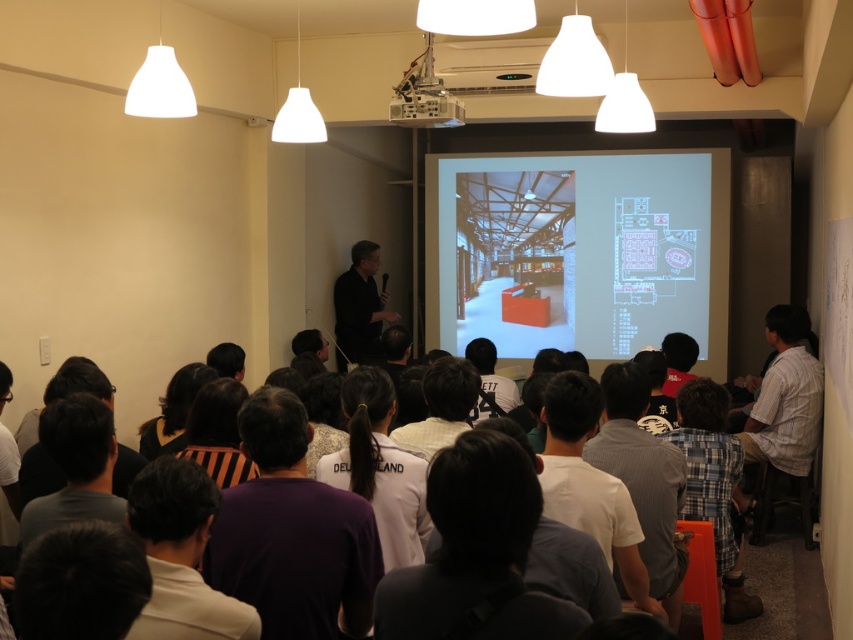
Does dark gray shirt at center have a larger size compared to black hair at center?

Yes.

Is point (352, 349) farther from viewer compared to point (155, 444)?

Yes, it is behind point (155, 444).

I want to click on dark gray shirt at center, so click(358, 308).

Between point (340, 369) and point (480, 346), which one is positioned behind?

The point (340, 369) is behind.

Who is lower down, dark gray shirt at center or black matte shirt at center?

black matte shirt at center

Is point (363, 324) positioned in front of point (508, 387)?

No, (363, 324) is behind (508, 387).

Identify the location of dark gray shirt at center. (358, 308).

Does dark brown hair at center lie in front of white plastic projector at upper center?

Yes, it is in front of white plastic projector at upper center.

Who is more distant from viewer, (212,516) or (421,92)?

The point (421,92) is behind.

Where is `dark brown hair at center`? This screenshot has height=640, width=853. dark brown hair at center is located at coordinates (181, 556).